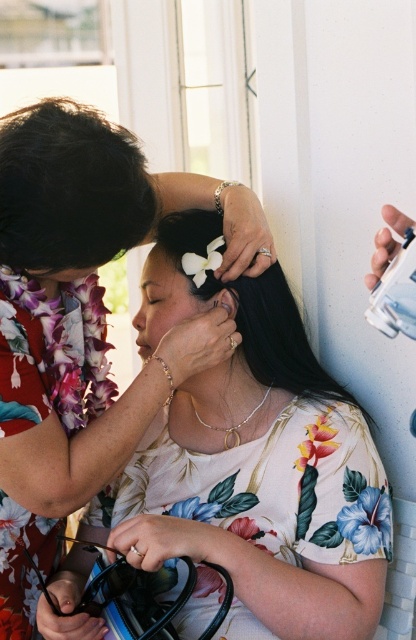
Question: Which of the following is the farthest from the observer?

Choices:
 (A) (69, 156)
 (B) (121, 147)
 (C) (289, 304)

Answer: (C)

Question: Can you confirm if floral fabric at center is positioned above black silky hair at center?

Choices:
 (A) yes
 (B) no

Answer: (B)

Question: Estimate the real-world distances between objects in this image. Which object is farther from the black silky hair at upper left?

Choices:
 (A) black silky hair at center
 (B) floral fabric at center

Answer: (A)

Question: In this image, where is floral fabric at center located relative to black silky hair at center?

Choices:
 (A) below
 (B) above

Answer: (A)

Question: Which is farther from the floral fabric at center?

Choices:
 (A) black silky hair at center
 (B) black silky hair at upper left

Answer: (A)

Question: Can you confirm if black silky hair at upper left is smaller than black silky hair at center?

Choices:
 (A) no
 (B) yes

Answer: (B)